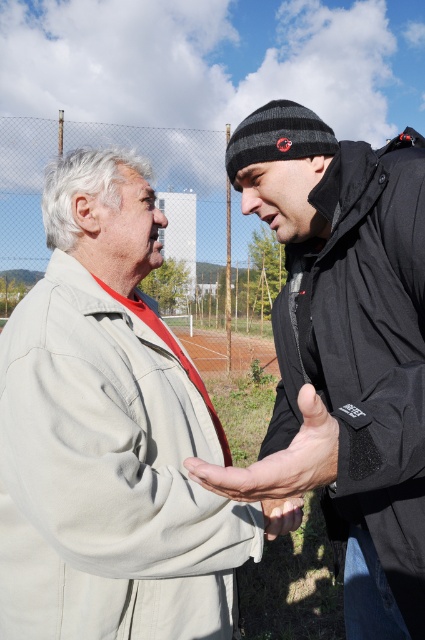
You are a photographer trying to capture a candid shot of the smooth skin hand at center and the black matte jacket at center. Based on their positions, which object should you focus on first to ensure both are in frame?

You should focus on the black matte jacket at center first since it is to the right of the smooth skin hand at center, so adjusting the frame to include the jacket will naturally include the hand as well.

You are a photographer trying to capture the black matte jacket at center and the dry skin hand at center in a single shot. Which object should you focus on first to ensure both are in frame?

The black matte jacket at center is located below the dry skin hand at center, so you should focus on the dry skin hand at center first to ensure both are in frame.

You are a photographer trying to capture a closeup of the black matte jacket at center and the dry skin hand at center. Since the camera can only focus on one object at a time, which object should you focus on to ensure it appears larger in the photo?

The black matte jacket at center is bigger than the dry skin hand at center, so focusing on the black matte jacket at center will make it appear larger in the photo.